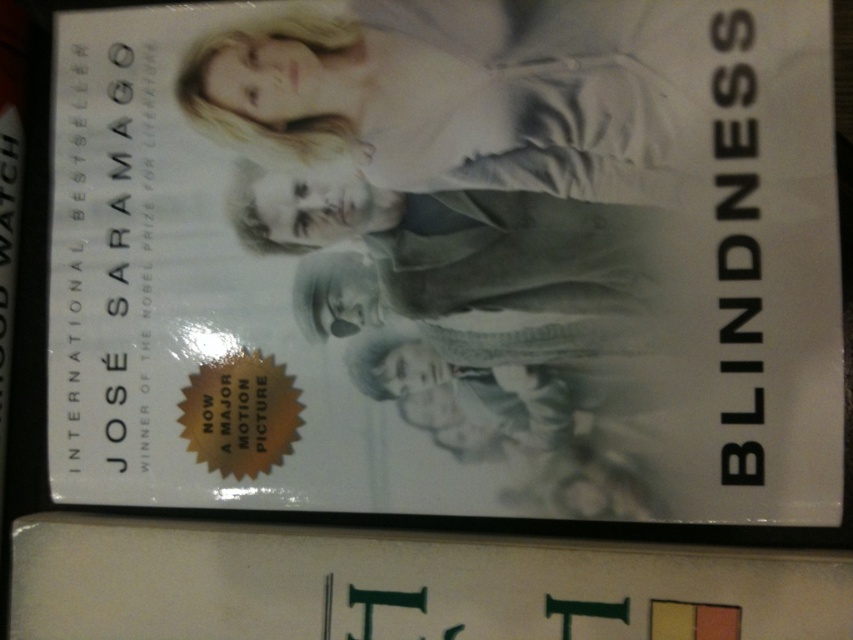
Question: Which of the following is the closest to the observer?

Choices:
 (A) (520, 147)
 (B) (337, 204)

Answer: (A)

Question: Is light beige fabric at upper center above smooth gray coat at center?

Choices:
 (A) no
 (B) yes

Answer: (B)

Question: Which of the following is the farthest from the observer?

Choices:
 (A) (527, 326)
 (B) (459, 129)

Answer: (B)

Question: Considering the relative positions of light beige fabric at upper center and smooth gray coat at center in the image provided, where is light beige fabric at upper center located with respect to smooth gray coat at center?

Choices:
 (A) below
 (B) above

Answer: (B)

Question: Can you confirm if light beige fabric at upper center is smaller than smooth gray coat at center?

Choices:
 (A) no
 (B) yes

Answer: (A)